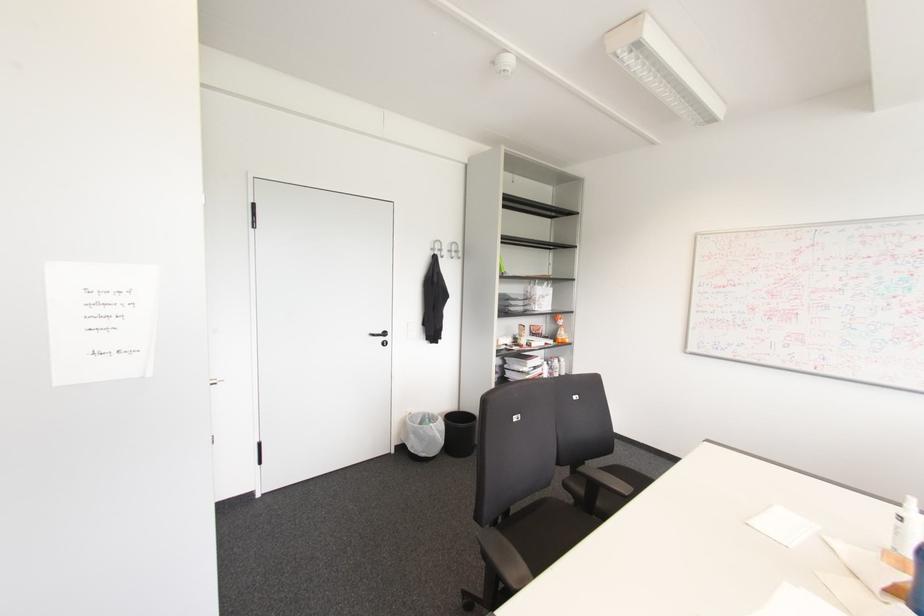
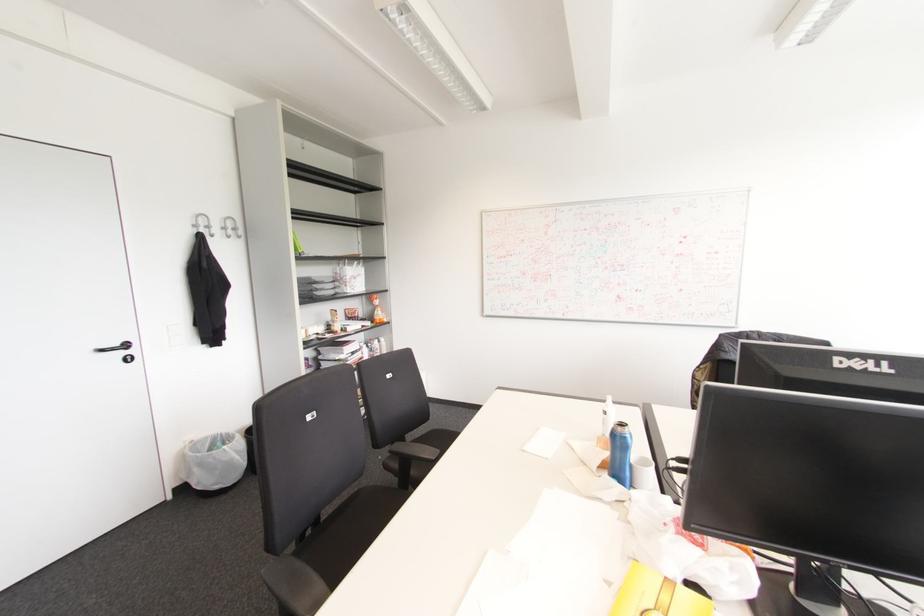
In the second image, find the point that corresponds to (630,488) in the first image.

(438, 451)